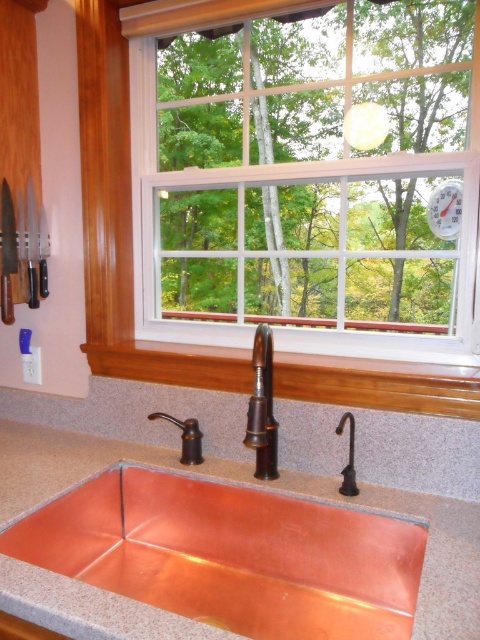
Who is shorter, copper metallic sink at center or copper metallic faucet at center?

copper metallic sink at center

Is point (48, 483) positioned before point (256, 336)?

No, (48, 483) is further to viewer.

Find the location of `copper metallic sink at center`. copper metallic sink at center is located at coordinates (279, 467).

Image resolution: width=480 pixels, height=640 pixels. I want to click on wooden window sill at center, so click(377, 385).

Image resolution: width=480 pixels, height=640 pixels. I want to click on wooden window sill at center, so click(377, 385).

Is point (446, 358) positioned behind point (144, 374)?

No, (446, 358) is in front of (144, 374).

Does white plastic window at upper center have a lesser width compared to wooden window sill at center?

Indeed, white plastic window at upper center has a lesser width compared to wooden window sill at center.

Which is in front, point (457, 83) or point (228, 372)?

Point (457, 83) is more forward.

The image size is (480, 640). In order to click on white plastic window at upper center in this screenshot , I will do `click(308, 182)`.